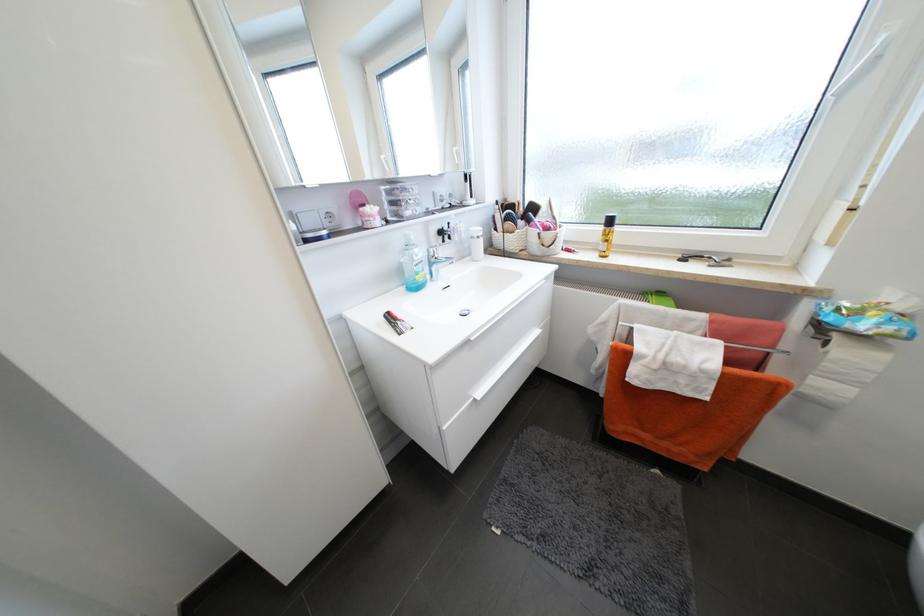
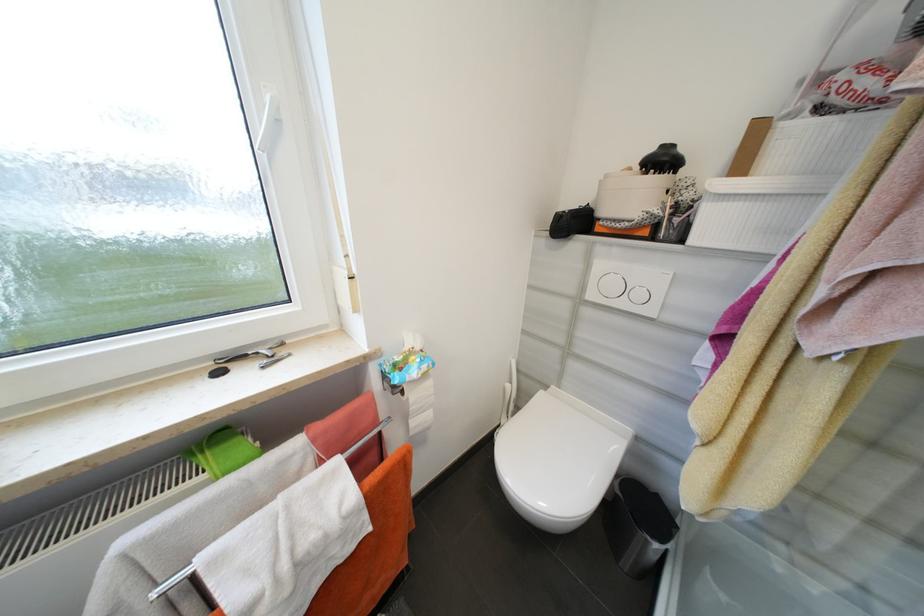
The point at (832,345) is marked in the first image. Where is the corresponding point in the second image?

(407, 392)